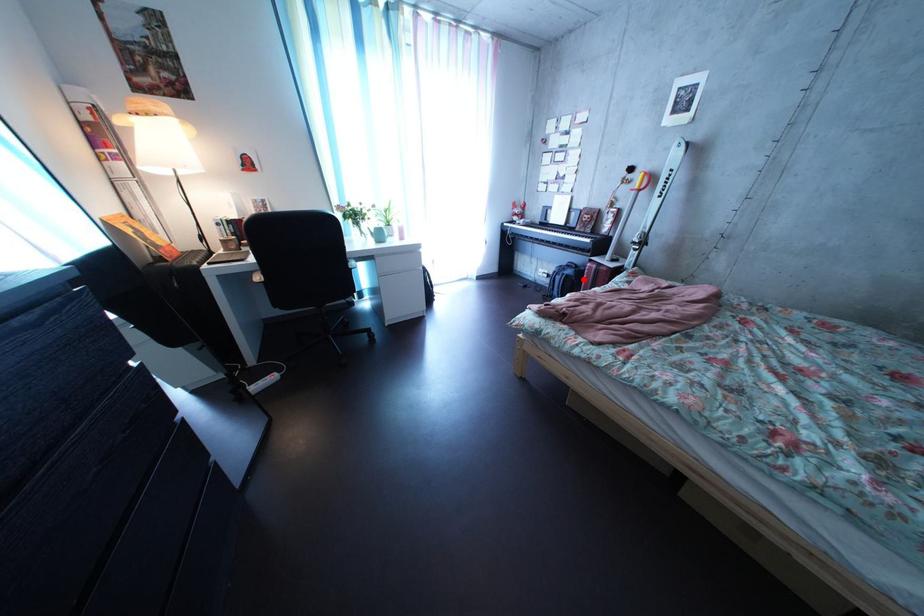
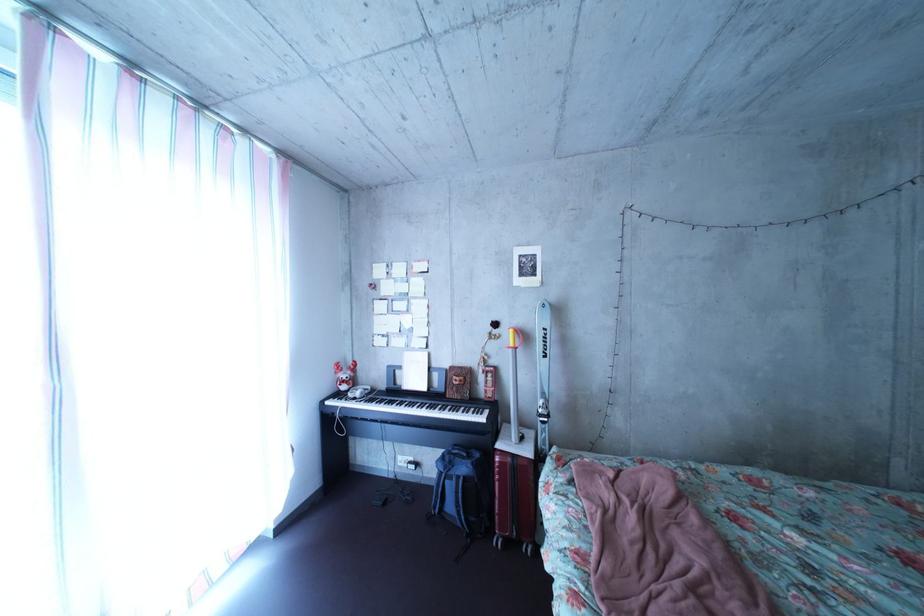
The point at the highlighted location is marked in the first image. Where is the corresponding point in the second image?

(479, 477)